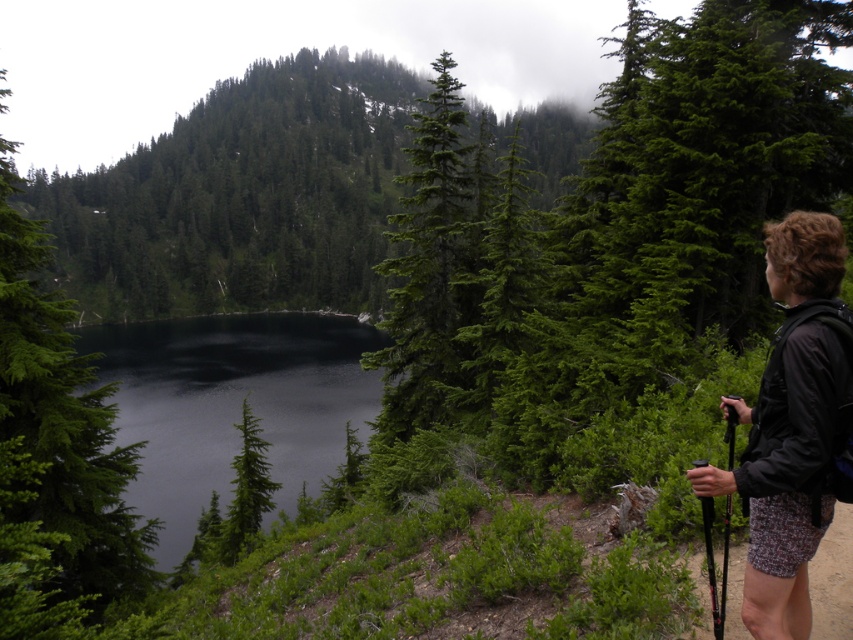
Is point (119, 582) farther from camera compared to point (746, 598)?

That is True.

Is green matte tree at left taller than dark brown fabric jacket at right?

Correct, green matte tree at left is much taller as dark brown fabric jacket at right.

Does point (49, 528) come farther from viewer compared to point (824, 524)?

Yes, it is behind point (824, 524).

The image size is (853, 640). What are the coordinates of `green matte tree at left` in the screenshot? It's located at (57, 461).

Is green evergreen tree at upper center thinner than green matte tree at left?

Incorrect, green evergreen tree at upper center's width is not less than green matte tree at left's.

Does green evergreen tree at upper center have a greater width compared to green matte tree at left?

Result: Yes, green evergreen tree at upper center is wider than green matte tree at left.

Image resolution: width=853 pixels, height=640 pixels. Identify the location of green evergreen tree at upper center. (242, 196).

Where is `green evergreen tree at upper center`? The height and width of the screenshot is (640, 853). green evergreen tree at upper center is located at coordinates (242, 196).

Measure the distance from green evergreen tree at upper center to dark brown fabric jacket at right.

185.01 meters

Is green evergreen tree at upper center to the left of dark brown fabric jacket at right from the viewer's perspective?

Yes, green evergreen tree at upper center is to the left of dark brown fabric jacket at right.

Between point (352, 225) and point (804, 561), which one is positioned in front?

Point (804, 561) is more forward.

Where is `green evergreen tree at upper center`? green evergreen tree at upper center is located at coordinates (242, 196).